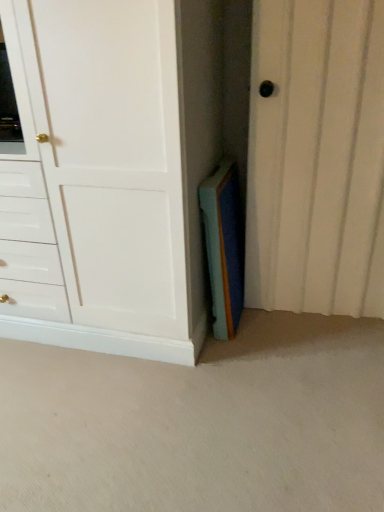
Question: Is the depth of white textured door at center less than that of white matte cabinet at center?

Choices:
 (A) yes
 (B) no

Answer: (B)

Question: Does white textured door at center turn towards white matte cabinet at center?

Choices:
 (A) yes
 (B) no

Answer: (B)

Question: Considering the relative sizes of white textured door at center and white matte cabinet at center in the image provided, is white textured door at center smaller than white matte cabinet at center?

Choices:
 (A) no
 (B) yes

Answer: (B)

Question: Is the position of white textured door at center more distant than that of white matte cabinet at center?

Choices:
 (A) no
 (B) yes

Answer: (B)

Question: Is white textured door at center located outside white matte cabinet at center?

Choices:
 (A) no
 (B) yes

Answer: (B)

Question: From a real-world perspective, is white textured door at center physically below white matte cabinet at center?

Choices:
 (A) yes
 (B) no

Answer: (A)

Question: Does white textured door at center have a lesser height compared to blue felt book at center?

Choices:
 (A) no
 (B) yes

Answer: (A)

Question: Is white textured door at center positioned with its back to blue felt book at center?

Choices:
 (A) no
 (B) yes

Answer: (A)

Question: From the image's perspective, is white textured door at center beneath blue felt book at center?

Choices:
 (A) yes
 (B) no

Answer: (B)

Question: Is white textured door at center not inside blue felt book at center?

Choices:
 (A) yes
 (B) no

Answer: (A)

Question: Is white textured door at center at the left side of blue felt book at center?

Choices:
 (A) no
 (B) yes

Answer: (A)

Question: Is white textured door at center wider than blue felt book at center?

Choices:
 (A) no
 (B) yes

Answer: (B)

Question: Is blue felt book at center far from white matte cabinet at center?

Choices:
 (A) yes
 (B) no

Answer: (B)